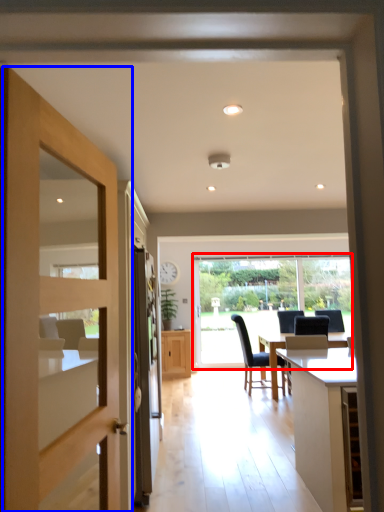
Question: Which object appears farthest to the camera in this image, window (highlighted by a red box) or door (highlighted by a blue box)?

Choices:
 (A) window
 (B) door

Answer: (A)